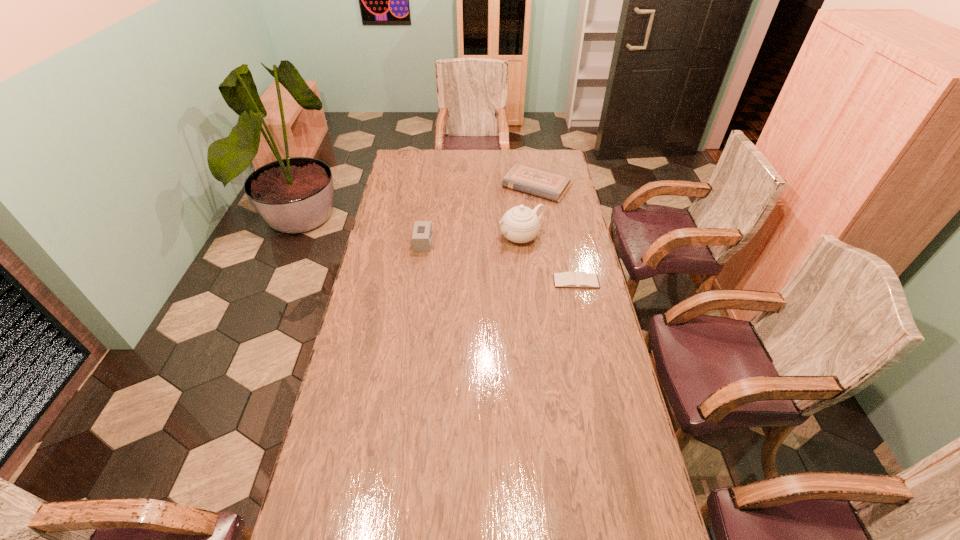
This screenshot has width=960, height=540. I want to click on vacant spot on the desktop that is between the second tallest object and the shortest object and is positioned on the spine side of the farthest object, so click(482, 258).

Image resolution: width=960 pixels, height=540 pixels. Find the location of `vacant spot on the desktop that is between the leftmost object and the diary and is positioned on the spout of the chinaware`. vacant spot on the desktop that is between the leftmost object and the diary and is positioned on the spout of the chinaware is located at coordinates click(x=477, y=256).